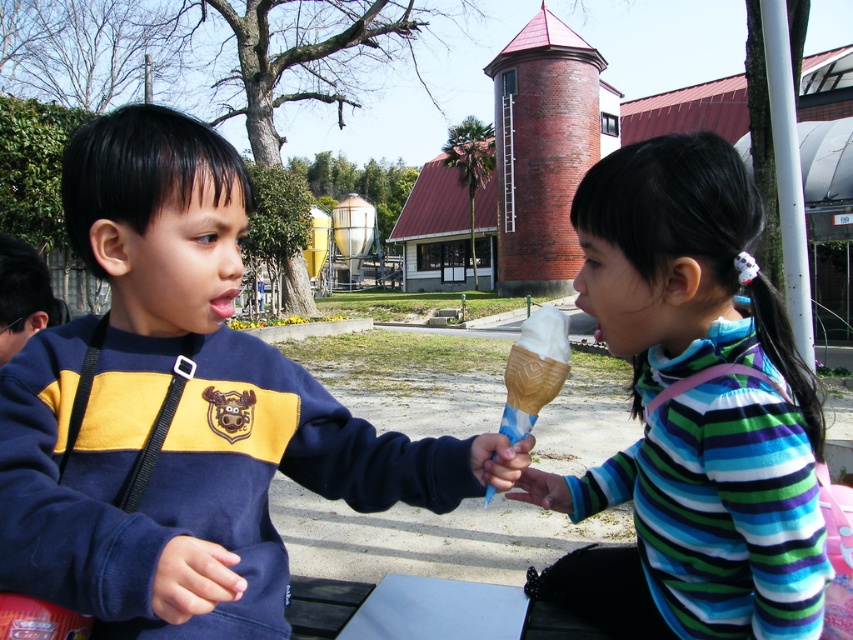
Question: Does white matte ice cream cone at right have a greater width compared to vanilla ice cream in waffle cone at center?

Choices:
 (A) yes
 (B) no

Answer: (A)

Question: Does matte blue sweatshirt at center appear under vanilla ice cream in waffle cone at center?

Choices:
 (A) yes
 (B) no

Answer: (B)

Question: Which of the following is the closest to the observer?

Choices:
 (A) vanilla ice cream in waffle cone at center
 (B) matte blue sweatshirt at center

Answer: (B)

Question: Does matte blue sweatshirt at center have a smaller size compared to white matte ice cream cone at right?

Choices:
 (A) no
 (B) yes

Answer: (B)

Question: Based on their relative distances, which object is nearer to the matte blue sweatshirt at center?

Choices:
 (A) white matte ice cream cone at right
 (B) vanilla ice cream in waffle cone at center

Answer: (B)

Question: Among these points, which one is nearest to the camera?

Choices:
 (A) (512, 435)
 (B) (606, 342)
 (C) (39, 570)

Answer: (C)